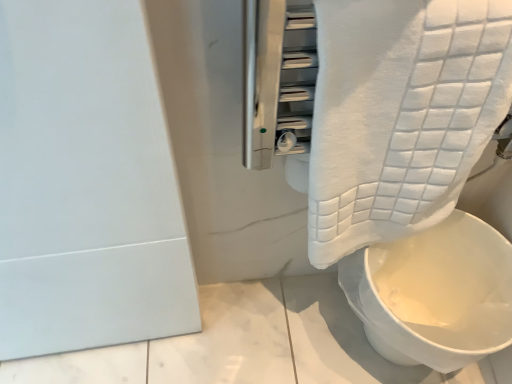
Where is `white textured towel at upper right`? This screenshot has width=512, height=384. white textured towel at upper right is located at coordinates pos(400,114).

The image size is (512, 384). Describe the element at coordinates (400, 114) in the screenshot. I see `white textured towel at upper right` at that location.

Image resolution: width=512 pixels, height=384 pixels. Identify the location of white fabric toilet at lower right. (438, 294).

What do you see at coordinates (438, 294) in the screenshot? This screenshot has height=384, width=512. I see `white fabric toilet at lower right` at bounding box center [438, 294].

Image resolution: width=512 pixels, height=384 pixels. What are the coordinates of `white textured towel at upper right` in the screenshot? It's located at (400, 114).

Can you confirm if white fabric toilet at lower right is positioned to the left of white textured towel at upper right?

In fact, white fabric toilet at lower right is to the right of white textured towel at upper right.

Is white fabric toilet at lower right behind white textured towel at upper right?

Yes, the depth of white fabric toilet at lower right is greater than that of white textured towel at upper right.

Which is behind, point (470, 220) or point (323, 143)?

The point (470, 220) is farther from the camera.

Based on the photo, from the image's perspective, which is below, white fabric toilet at lower right or white textured towel at upper right?

white fabric toilet at lower right appears lower in the image.

From a real-world perspective, is white fabric toilet at lower right above or below white textured towel at upper right?

From a real-world perspective, white fabric toilet at lower right is physically below white textured towel at upper right.

Considering the sizes of white fabric toilet at lower right and white textured towel at upper right in the image, is white fabric toilet at lower right wider or thinner than white textured towel at upper right?

Considering their sizes, white fabric toilet at lower right looks broader than white textured towel at upper right.

Who is taller, white fabric toilet at lower right or white textured towel at upper right?

white textured towel at upper right.

Looking at the image, does white fabric toilet at lower right seem bigger or smaller compared to white textured towel at upper right?

Considering their sizes, white fabric toilet at lower right takes up more space than white textured towel at upper right.

Is white fabric toilet at lower right located outside white textured towel at upper right?

Yes, white fabric toilet at lower right is not within white textured towel at upper right.

Are white fabric toilet at lower right and white textured towel at upper right located far from each other?

No, white fabric toilet at lower right is not far away from white textured towel at upper right.

Is white fabric toilet at lower right aimed at white textured towel at upper right?

No, white fabric toilet at lower right is not oriented towards white textured towel at upper right.

From the picture: What's the angular difference between white fabric toilet at lower right and white textured towel at upper right's facing directions?

There is a 2.25-degree angle between the facing directions of white fabric toilet at lower right and white textured towel at upper right.

Measure the distance from white fabric toilet at lower right to white textured towel at upper right.

white fabric toilet at lower right is 22.62 centimeters from white textured towel at upper right.

This screenshot has height=384, width=512. Identify the location of towel that is above the white fabric toilet at lower right (from the image's perspective). (400, 114).

Between white textured towel at upper right and white fabric toilet at lower right, which one appears on the left side from the viewer's perspective?

Positioned to the left is white textured towel at upper right.

Which is in front, white textured towel at upper right or white fabric toilet at lower right?

white textured towel at upper right.

Does point (413, 98) appear closer or farther from the camera than point (497, 346)?

Point (413, 98) appears to be closer to the viewer than point (497, 346).

From the image's perspective, is white textured towel at upper right on top of white fabric toilet at lower right?

Indeed, from the image's perspective, white textured towel at upper right is shown above white fabric toilet at lower right.

From a real-world perspective, between white textured towel at upper right and white fabric toilet at lower right, who is vertically higher?

white textured towel at upper right, from a real-world perspective.

Which object is wider, white textured towel at upper right or white fabric toilet at lower right?

Wider between the two is white fabric toilet at lower right.

Considering the relative sizes of white textured towel at upper right and white fabric toilet at lower right in the image provided, is white textured towel at upper right taller than white fabric toilet at lower right?

Indeed, white textured towel at upper right has a greater height compared to white fabric toilet at lower right.

Considering the sizes of objects white textured towel at upper right and white fabric toilet at lower right in the image provided, who is bigger, white textured towel at upper right or white fabric toilet at lower right?

Bigger between the two is white fabric toilet at lower right.

From the picture: Could white fabric toilet at lower right be considered to be inside white textured towel at upper right?

No, white fabric toilet at lower right is not a part of white textured towel at upper right.

Looking at this image, would you consider white textured towel at upper right to be distant from white fabric toilet at lower right?

No, white textured towel at upper right is not far away from white fabric toilet at lower right.

From the picture: Is white textured towel at upper right facing towards white fabric toilet at lower right?

No.

Find the location of `towel on the left of white fabric toilet at lower right`. towel on the left of white fabric toilet at lower right is located at coordinates (400, 114).

In the image, there is a white textured towel at upper right. Where is `toilet below it (from the image's perspective)`? The width and height of the screenshot is (512, 384). toilet below it (from the image's perspective) is located at coordinates (438, 294).

At what (x,y) coordinates should I click in order to perform the action: click on toilet on the right of white textured towel at upper right. Please return your answer as a coordinate pair (x, y). Looking at the image, I should click on (438, 294).